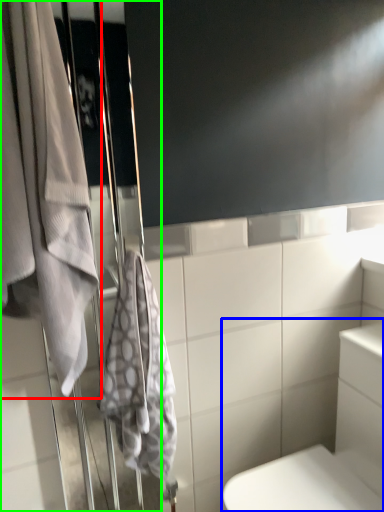
Question: Which object is positioned farthest from towel (highlighted by a red box)? Select from bath (highlighted by a blue box) and screen door (highlighted by a green box).

Choices:
 (A) bath
 (B) screen door

Answer: (A)